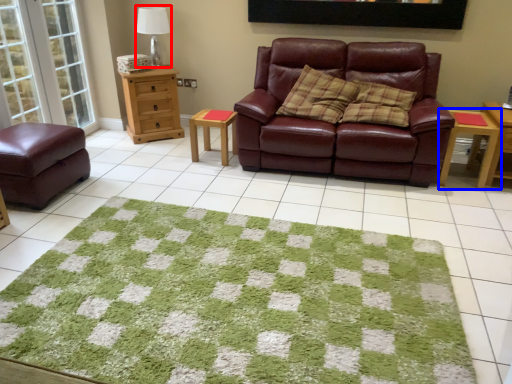
Question: Which point is further to the camera, table lamp (highlighted by a red box) or table (highlighted by a blue box)?

Choices:
 (A) table lamp
 (B) table

Answer: (A)